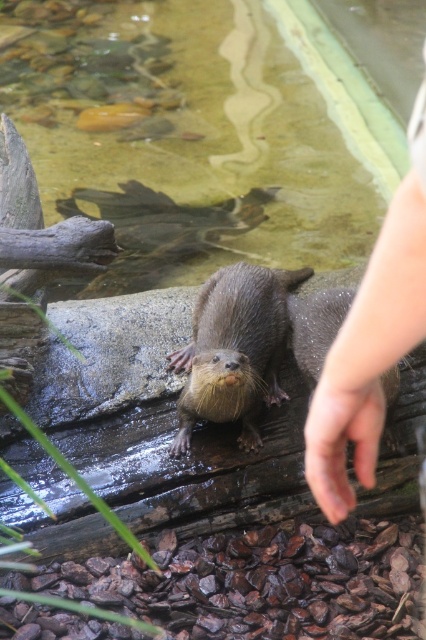
Question: Can you confirm if brown furry otter at center is wider than skinny flesh at center?

Choices:
 (A) yes
 (B) no

Answer: (A)

Question: Which point appears farthest from the camera in this image?

Choices:
 (A) (385, 284)
 (B) (172, 353)
 (C) (368, 448)

Answer: (B)

Question: In this image, where is skinny flesh at upper right located relative to skinny flesh at center?

Choices:
 (A) below
 (B) above

Answer: (B)

Question: Which object is the farthest from the skinny flesh at center?

Choices:
 (A) skinny flesh at upper right
 (B) brown furry otter at center

Answer: (B)

Question: Estimate the real-world distances between objects in this image. Which object is farther from the skinny flesh at upper right?

Choices:
 (A) brown furry otter at center
 (B) skinny flesh at center

Answer: (A)

Question: Is brown furry otter at center to the left of skinny flesh at center from the viewer's perspective?

Choices:
 (A) no
 (B) yes

Answer: (B)